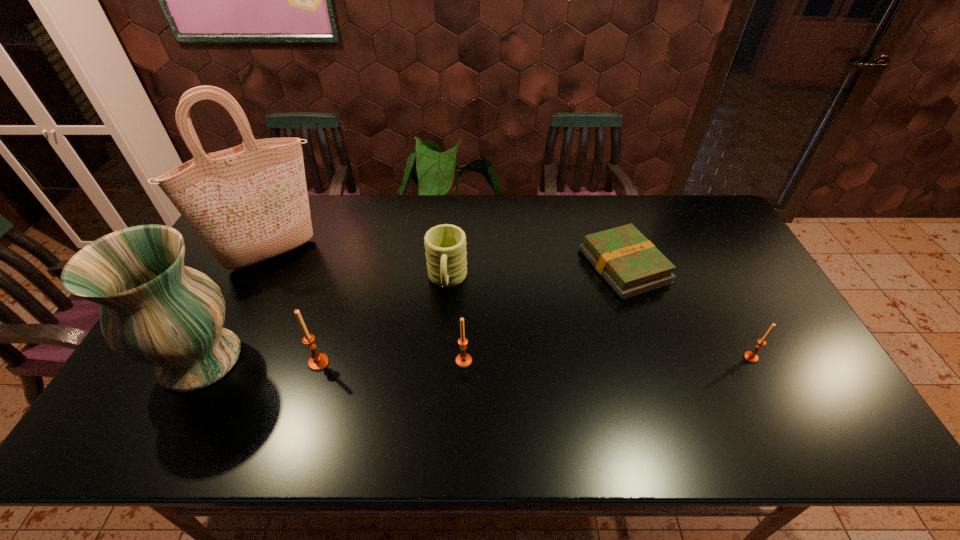
Identify the location of unoccupied area between the vase and the rightmost candle_holder. (476, 359).

You are a GUI agent. You are given a task and a screenshot of the screen. Output one action in this format:
    pyautogui.click(x=<x>, y=<y>)
    Task: Click on the empty location between the rightmost object and the mug
    
    Given the screenshot: What is the action you would take?
    pyautogui.click(x=599, y=319)

Find the location of a particular element. The width and height of the screenshot is (960, 540). free point between the shortest candle_holder and the second candle_holder from left to right is located at coordinates (608, 359).

Find the location of a particular element. The image size is (960, 540). vacant region between the mug and the second shortest candle_holder is located at coordinates (455, 321).

Where is `unoccupied area between the sixth object from left to right and the mug`? unoccupied area between the sixth object from left to right and the mug is located at coordinates (536, 273).

Identify the location of free space between the book and the shortest candle_holder. (687, 312).

Choose which object is the nearest neighbor to the second candle_holder from right to left. Please provide its 2D coordinates. Your answer should be formatted as a tuple, i.e. [(x, y)], where the tuple contains the x and y coordinates of a point satisfying the conditions above.

[(445, 245)]

Choose which object is the second nearest neighbor to the mug. Please provide its 2D coordinates. Your answer should be formatted as a tuple, i.e. [(x, y)], where the tuple contains the x and y coordinates of a point satisfying the conditions above.

[(318, 361)]

Identify the location of candle_holder that is the second nearest to the vase. This screenshot has width=960, height=540. (463, 360).

The image size is (960, 540). Find the location of `the closest candle_holder to the rightmost candle_holder`. the closest candle_holder to the rightmost candle_holder is located at coordinates (463, 360).